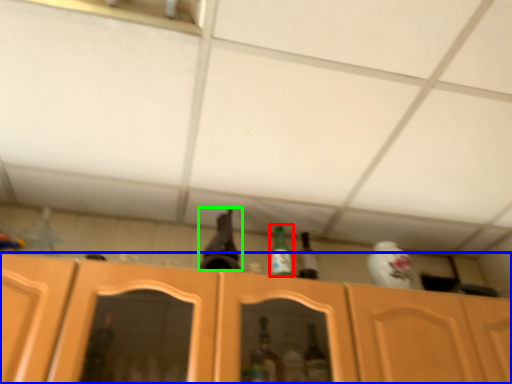
Question: Which object is positioned farthest from bottle (highlighted by a red box)? Select from cabinetry (highlighted by a blue box) and beer bottle (highlighted by a green box).

Choices:
 (A) cabinetry
 (B) beer bottle

Answer: (A)